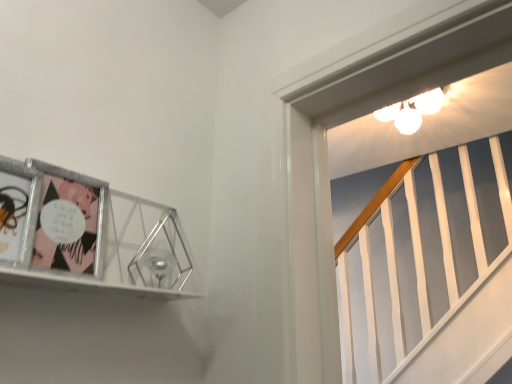
Question: From the image's perspective, is metallic silver picture frame at upper left above or below matte black comic book at left, the first comic book when ordered from front to back?

Choices:
 (A) above
 (B) below

Answer: (B)

Question: In terms of size, does metallic silver picture frame at upper left appear bigger or smaller than matte black comic book at left, the first comic book when ordered from front to back?

Choices:
 (A) big
 (B) small

Answer: (A)

Question: Which is nearer to the matte plastic comic book at left, marked as the 2th comic book in a front-to-back arrangement?

Choices:
 (A) matte black comic book at left, the first comic book when ordered from front to back
 (B) metallic silver picture frame at upper left

Answer: (B)

Question: Based on their relative distances, which object is nearer to the matte plastic comic book at left, marked as the 2th comic book in a front-to-back arrangement?

Choices:
 (A) metallic silver picture frame at upper left
 (B) matte black comic book at left, the second comic book in the back-to-front sequence

Answer: (A)